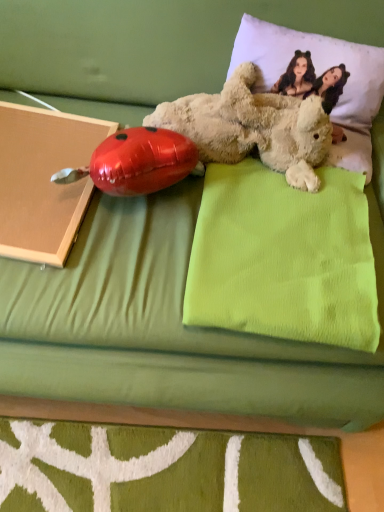
Find the location of `free space above shiny metallic ladybug at left (from a real-world perspective)`. free space above shiny metallic ladybug at left (from a real-world perspective) is located at coordinates (138, 145).